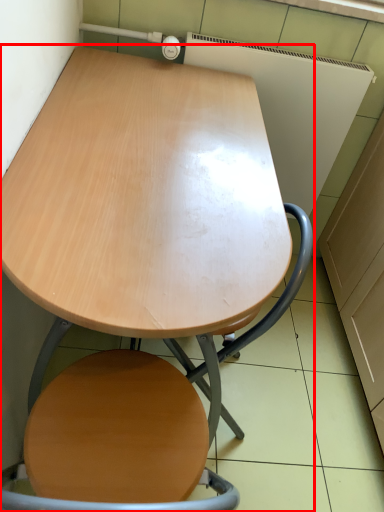
Question: From the image, what is the correct spatial relationship of table (annotated by the red box) in relation to swivel chair?

Choices:
 (A) right
 (B) left

Answer: (B)